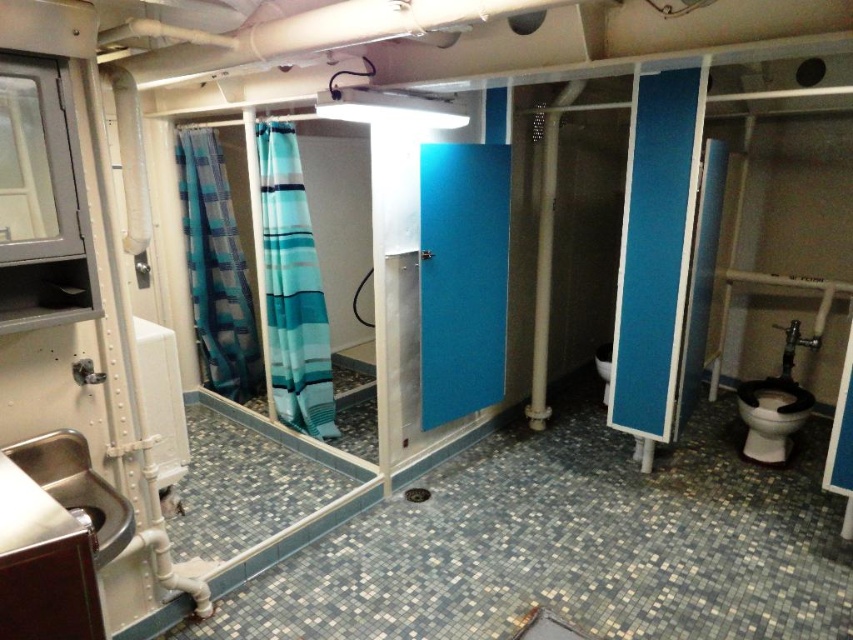
Question: Which point is farther to the camera?

Choices:
 (A) stainless steel sink at lower left
 (B) blue striped fabric at left
 (C) blue matte door at center

Answer: (B)

Question: Which of the following is the farthest from the observer?

Choices:
 (A) (459, 205)
 (B) (279, 387)
 (C) (245, 355)
 (D) (775, 380)

Answer: (C)

Question: Among these points, which one is nearest to the camera?

Choices:
 (A) (431, 234)
 (B) (793, 403)
 (C) (291, 144)

Answer: (A)

Question: Can you confirm if teal striped fabric at left is positioned to the left of stainless steel sink at lower left?

Choices:
 (A) yes
 (B) no

Answer: (B)

Question: Can you confirm if blue matte door at center is wider than black glossy toilet bowl at lower right?

Choices:
 (A) no
 (B) yes

Answer: (B)

Question: Can you confirm if blue striped fabric at left is positioned to the left of black glossy toilet bowl at lower right?

Choices:
 (A) no
 (B) yes

Answer: (B)